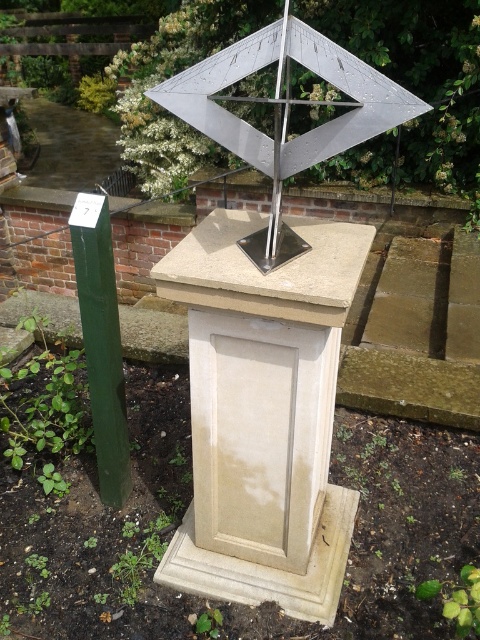
Is point (286, 556) positioned behind point (331, 77)?

Yes.

Is point (264, 408) closer to camera compared to point (389, 97)?

No.

Is point (298, 388) closer to camera compared to point (289, 24)?

No, it is not.

At what (x,y) coordinates should I click in order to perform the action: click on beige stone pedestal at center. Please return your answer as a coordinate pair (x, y). This screenshot has height=640, width=480. Looking at the image, I should click on (264, 413).

Between beige stone pedestal at center and metallic pole at center, which one has more height?

With more height is beige stone pedestal at center.

Between point (220, 480) and point (267, 248), which one is positioned in front?

Point (267, 248)

Locate an element on the screen. This screenshot has height=640, width=480. beige stone pedestal at center is located at coordinates (264, 413).

Does metallic silver sundial at center appear over metallic pole at center?

Actually, metallic silver sundial at center is below metallic pole at center.

Find the location of `metallic silver sundial at center`. metallic silver sundial at center is located at coordinates (285, 115).